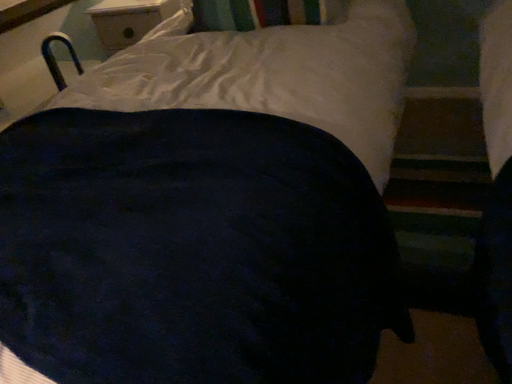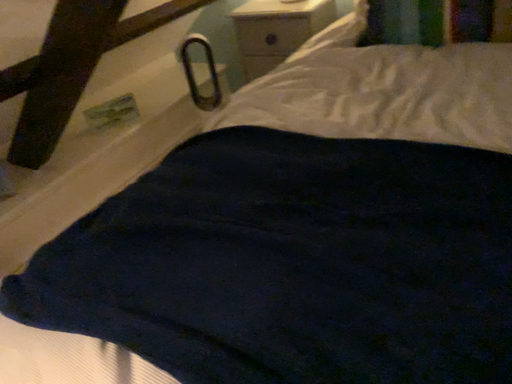
Question: How did the camera likely rotate when shooting the video?

Choices:
 (A) rotated right
 (B) rotated left

Answer: (B)